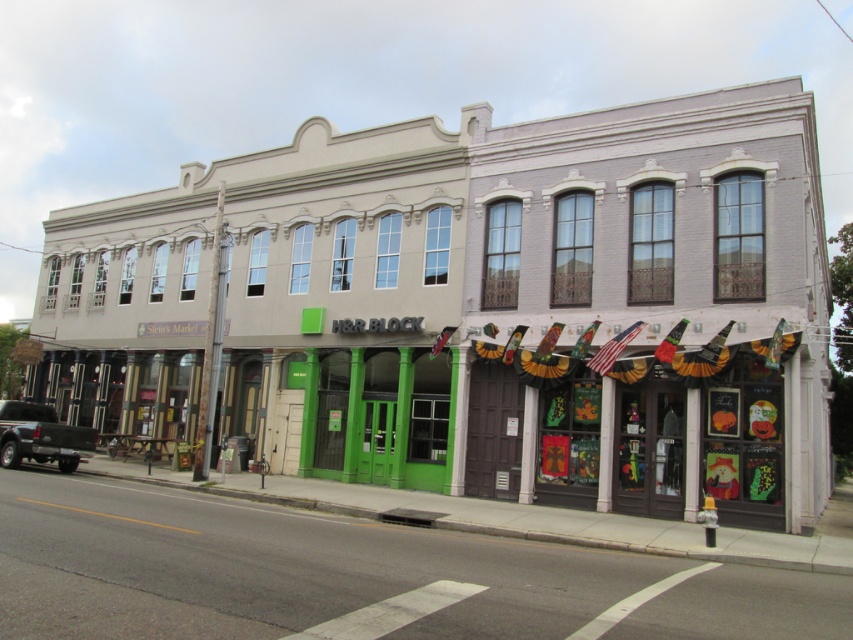
Question: Does white brick building at center have a smaller size compared to matte black truck at lower left?

Choices:
 (A) no
 (B) yes

Answer: (A)

Question: Can you confirm if white brick building at center is bigger than matte black truck at lower left?

Choices:
 (A) no
 (B) yes

Answer: (B)

Question: Which of the following is the farthest from the observer?

Choices:
 (A) (51, 419)
 (B) (432, 460)

Answer: (A)

Question: Among these points, which one is farthest from the camera?

Choices:
 (A) (4, 408)
 (B) (717, 237)

Answer: (A)

Question: Is white brick building at center smaller than matte black truck at lower left?

Choices:
 (A) yes
 (B) no

Answer: (B)